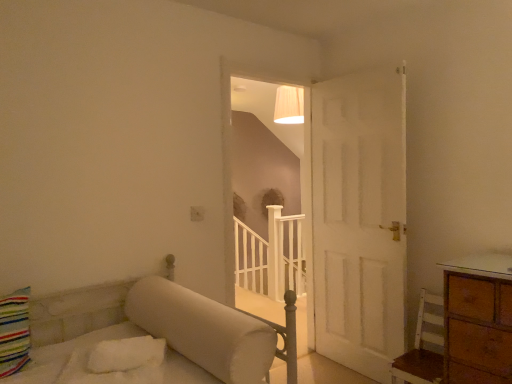
Question: From the image's perspective, is white matte staircase at center located above or below white wood chair at lower right?

Choices:
 (A) below
 (B) above

Answer: (B)

Question: Considering the positions of point pyautogui.click(x=249, y=105) and point pyautogui.click(x=419, y=307), is point pyautogui.click(x=249, y=105) closer or farther from the camera than point pyautogui.click(x=419, y=307)?

Choices:
 (A) closer
 (B) farther

Answer: (B)

Question: Estimate the real-world distances between objects in this image. Which object is farther from the white wooden balustrade at center?

Choices:
 (A) white wood chair at lower right
 (B) white matte staircase at center

Answer: (A)

Question: Estimate the real-world distances between objects in this image. Which object is farther from the white matte staircase at center?

Choices:
 (A) white wooden balustrade at center
 (B) white wood chair at lower right

Answer: (B)